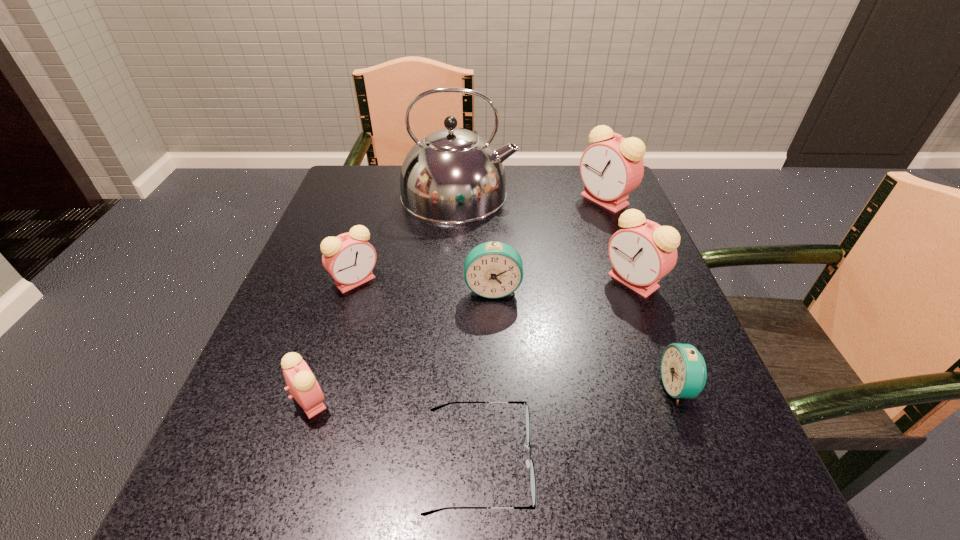
Where is `the nearest pink alarm clock`? This screenshot has height=540, width=960. the nearest pink alarm clock is located at coordinates (302, 384).

The image size is (960, 540). Identify the location of the shortest object. (530, 464).

Locate an element on the screen. black spectacles is located at coordinates (530, 464).

What are the coordinates of `vacant space situated from the spout of the tallest object` in the screenshot? It's located at (583, 194).

The height and width of the screenshot is (540, 960). In order to click on vacant space located 0.350m on the face of the tallest alarm clock in this screenshot , I will do `click(440, 200)`.

Where is `vacant region located 0.180m on the face of the tallest alarm clock`? vacant region located 0.180m on the face of the tallest alarm clock is located at coordinates [x=507, y=200].

You are a GUI agent. You are given a task and a screenshot of the screen. Output one action in this format:
    pyautogui.click(x=<x>, y=<y>)
    Task: Click on the free point located 0.230m on the face of the tallest alarm clock
    The width and height of the screenshot is (960, 540).
    Given the screenshot: What is the action you would take?
    pyautogui.click(x=487, y=200)

Find the location of a particular element. The image size is (960, 540). free spot located on the face of the third tallest object is located at coordinates (418, 281).

The image size is (960, 540). I want to click on free space located on the face of the third tallest object, so click(575, 281).

This screenshot has height=540, width=960. What are the coordinates of `free space located on the face of the third tallest object` in the screenshot? It's located at (496, 281).